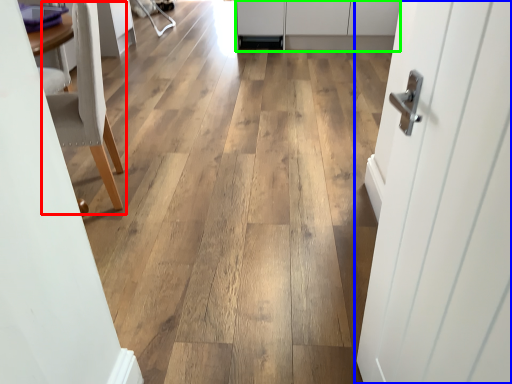
Question: Considering the real-world distances, which object is farthest from chair (highlighted by a red box)? door (highlighted by a blue box) or cabinetry (highlighted by a green box)?

Choices:
 (A) door
 (B) cabinetry

Answer: (B)